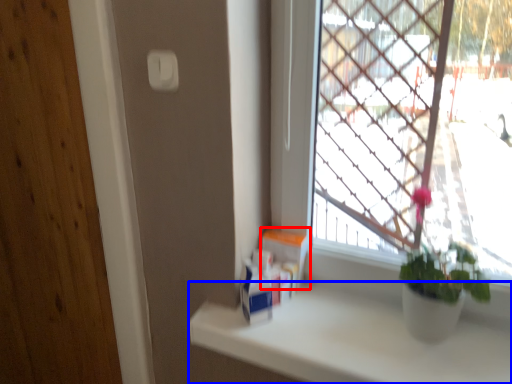
Question: Among these objects, which one is nearest to the camera, window box (highlighted by a red box) or counter top (highlighted by a blue box)?

Choices:
 (A) window box
 (B) counter top

Answer: (B)